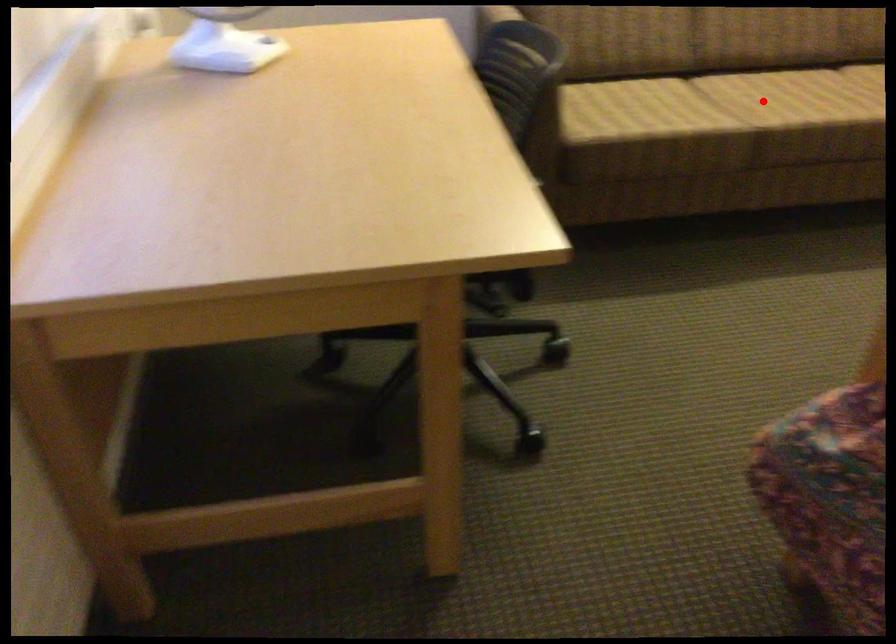
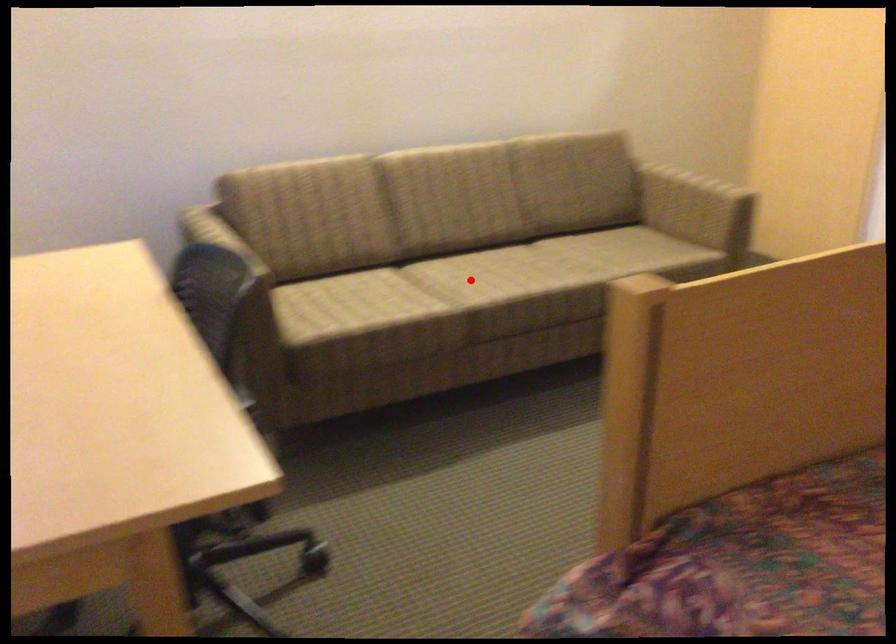
I am providing you with two images of the same scene from different viewpoints. A red point is marked on the first image and another point is marked on the second image. Is the marked point in image1 the same physical position as the marked point in image2?

Yes